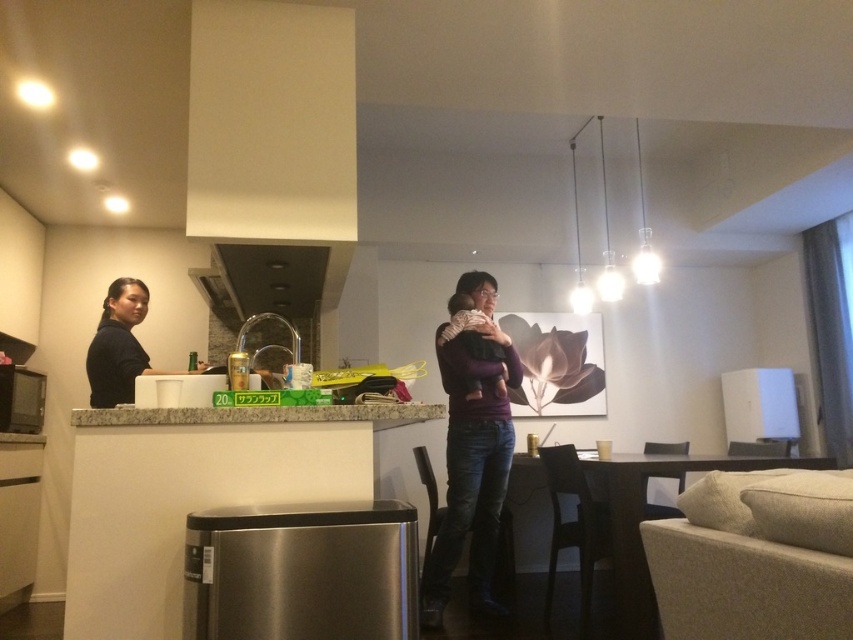
You are organizing a closet and see the dark purple sweater at center and the black matte shirt at upper left. Which clothing item is positioned to the right of the other?

The dark purple sweater at center is positioned to the right of the black matte shirt at upper left.

You are a delivery person standing in front of the granite countertop at center. Your package needs to be placed exactly 2 meters away from the counter. Can you place it here?

The granite countertop at center is 1.74 meters away from the camera, so placing the package here would be closer than the required 2 meters. Move further back to ensure the package is placed at the correct distance.